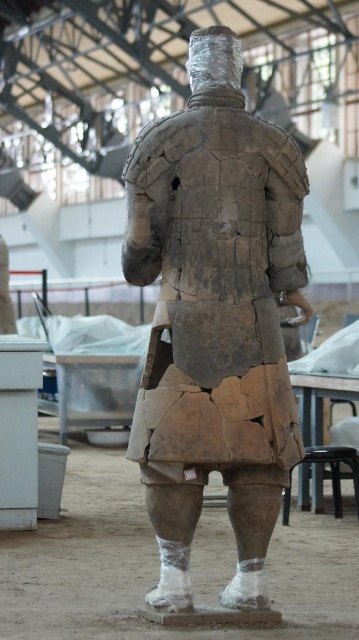
I want to click on cracked clay armor at center, so click(x=215, y=317).

Is cracked clay armor at center bigger than black plastic stool at lower right?

Indeed, cracked clay armor at center has a larger size compared to black plastic stool at lower right.

Between point (175, 320) and point (337, 472), which one is positioned behind?

The point (337, 472) is more distant.

You are a GUI agent. You are given a task and a screenshot of the screen. Output one action in this format:
    pyautogui.click(x=<x>, y=<y>)
    Task: Click on the cracked clay armor at center
    The image size is (359, 640).
    Given the screenshot: What is the action you would take?
    pyautogui.click(x=215, y=317)